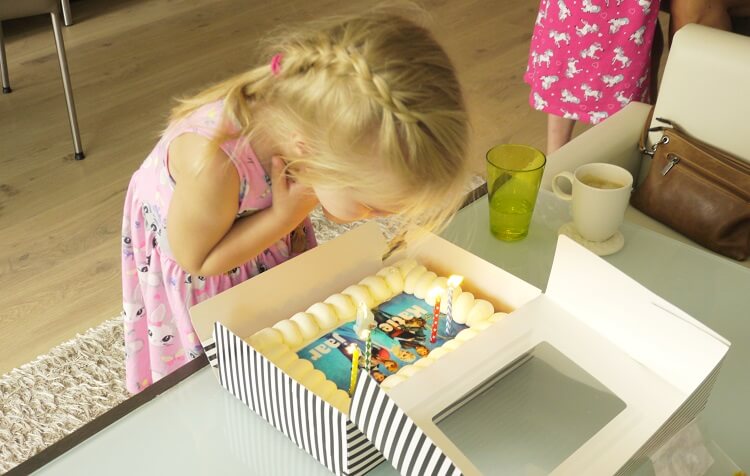
Where is `wood floor`? wood floor is located at coordinates (45, 182).